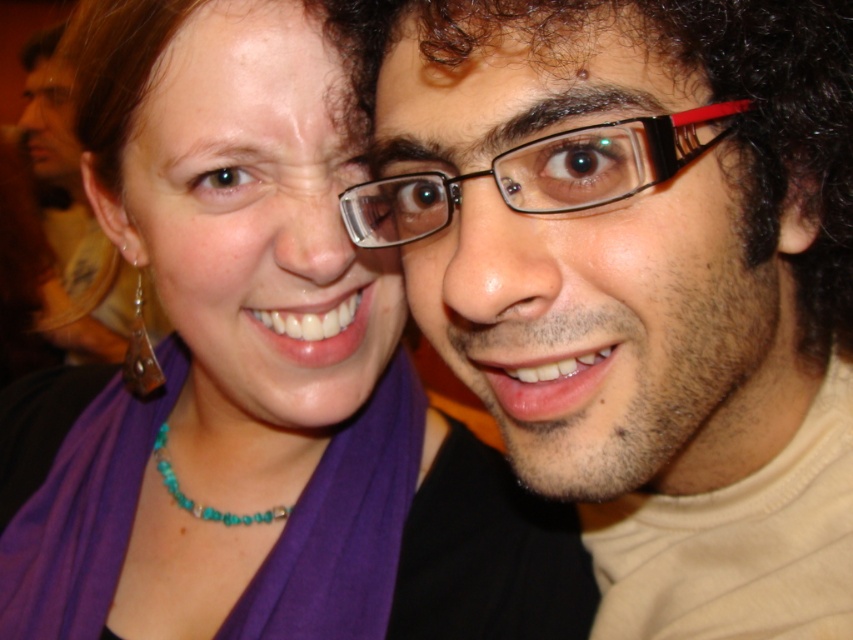
You are a photographer reviewing this image. You notice the matte black glasses at upper right and the gold metallic earring at left. Which object would appear closer to you in the image?

The matte black glasses at upper right appears closer to you because it is further to the viewer than the gold metallic earring at left.

You are a photographer adjusting the focus of your camera. You want to ensure that both the matte black glasses at upper right and the gold metallic earring at left are clearly visible in the photo. Given their sizes, which object should you prioritize focusing on to ensure it remains sharp?

The matte black glasses at upper right has a larger size compared to the gold metallic earring at left, so you should prioritize focusing on the matte black glasses at upper right to ensure it remains sharp.